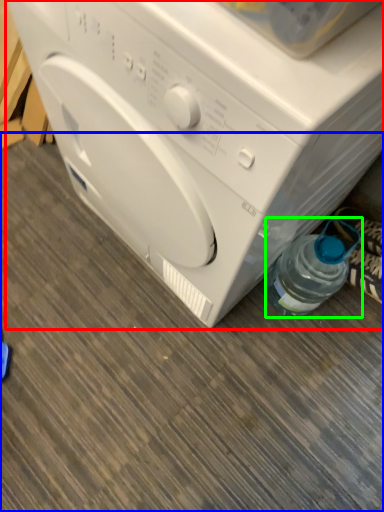
Question: Which object is positioned closest to washing machine (highlighted by a red box)? Select from surface (highlighted by a blue box) and bottle (highlighted by a green box).

Choices:
 (A) surface
 (B) bottle

Answer: (B)